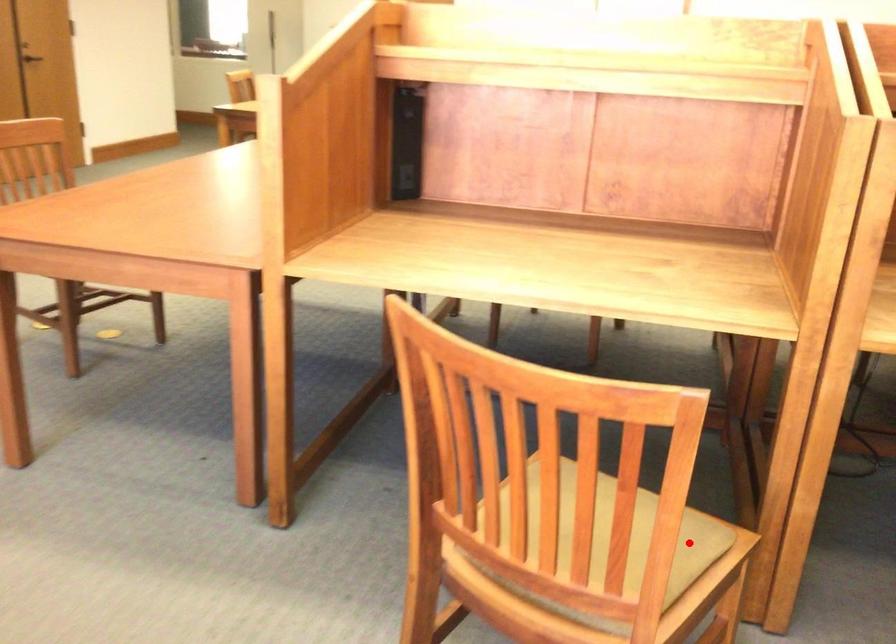
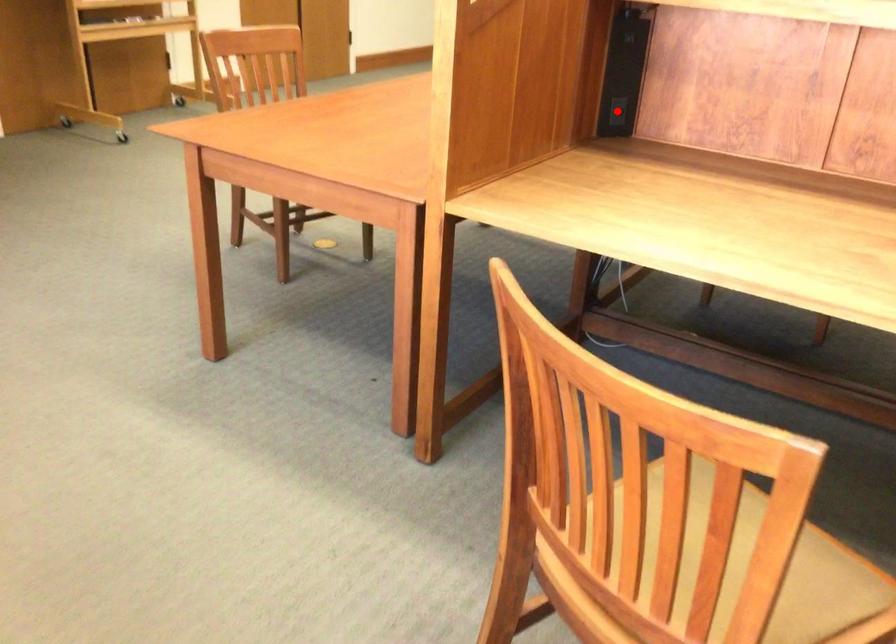
I am providing you with two images of the same scene from different viewpoints. A red point is marked on the first image and another point is marked on the second image. Are the points marked in image1 and image2 representing the same 3D position?

No